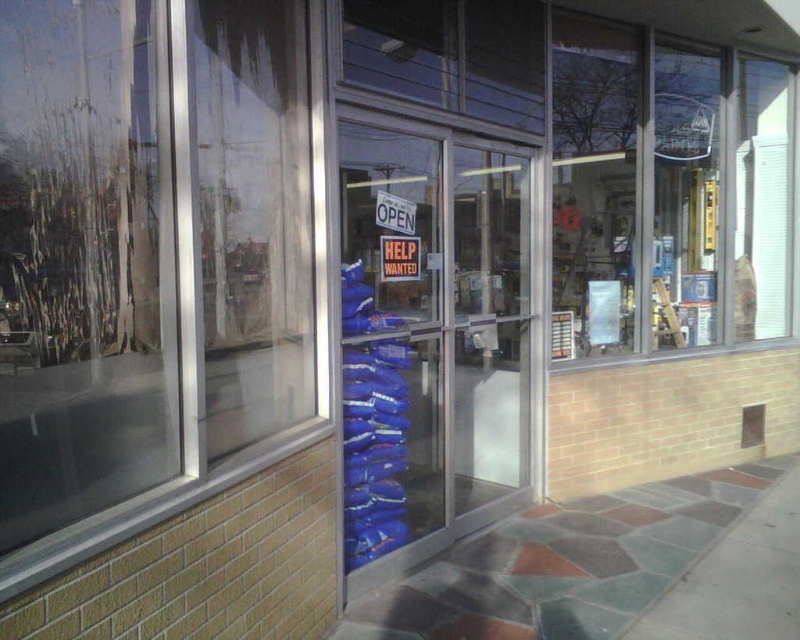
You are a GUI agent. You are given a task and a screenshot of the screen. Output one action in this format:
    pyautogui.click(x=<x>, y=<y>)
    Task: Click on the transparent glass door at center
    This screenshot has width=800, height=640.
    Given the screenshot: What is the action you would take?
    pyautogui.click(x=437, y=337)

Does transparent glass door at center have a lesser width compared to marble tile pavement at lower right?

Indeed, transparent glass door at center has a lesser width compared to marble tile pavement at lower right.

Locate an element on the screen. The width and height of the screenshot is (800, 640). transparent glass door at center is located at coordinates (x=437, y=337).

Locate an element on the screen. transparent glass door at center is located at coordinates (437, 337).

Is marble-like stone pavement at center positioned in front of marble tile pavement at lower right?

No, it is behind marble tile pavement at lower right.

Can you confirm if marble-like stone pavement at center is positioned to the left of marble tile pavement at lower right?

Indeed, marble-like stone pavement at center is positioned on the left side of marble tile pavement at lower right.

Where is `marble-like stone pavement at center`? This screenshot has height=640, width=800. marble-like stone pavement at center is located at coordinates (568, 563).

Is transparent glass window at upper left smaller than red paper help wanted sign at center?

No, transparent glass window at upper left is not smaller than red paper help wanted sign at center.

Between transparent glass window at upper left and red paper help wanted sign at center, which one has more height?

With more height is transparent glass window at upper left.

Where is `transparent glass window at upper left`? transparent glass window at upper left is located at coordinates (152, 262).

Where is `transparent glass window at upper left`? This screenshot has height=640, width=800. transparent glass window at upper left is located at coordinates (152, 262).